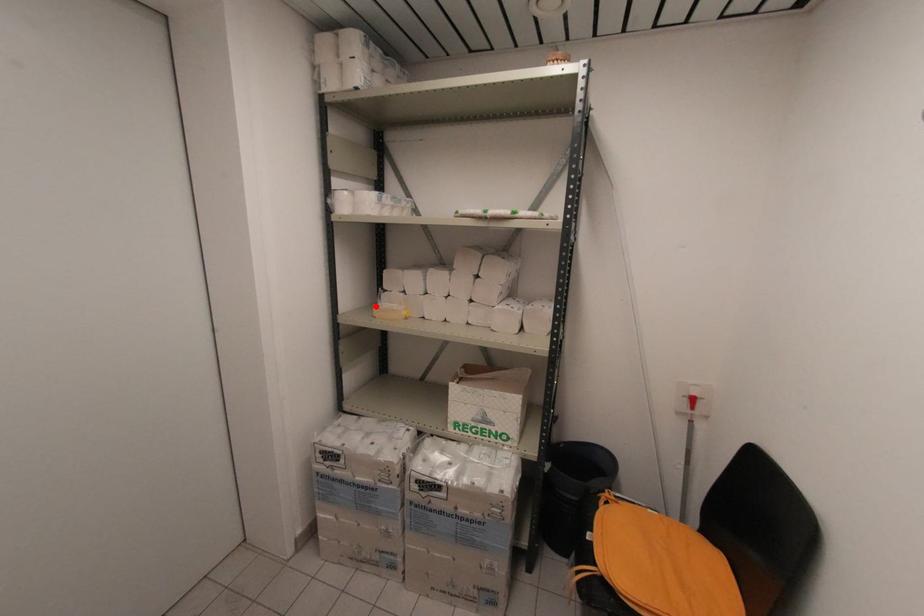
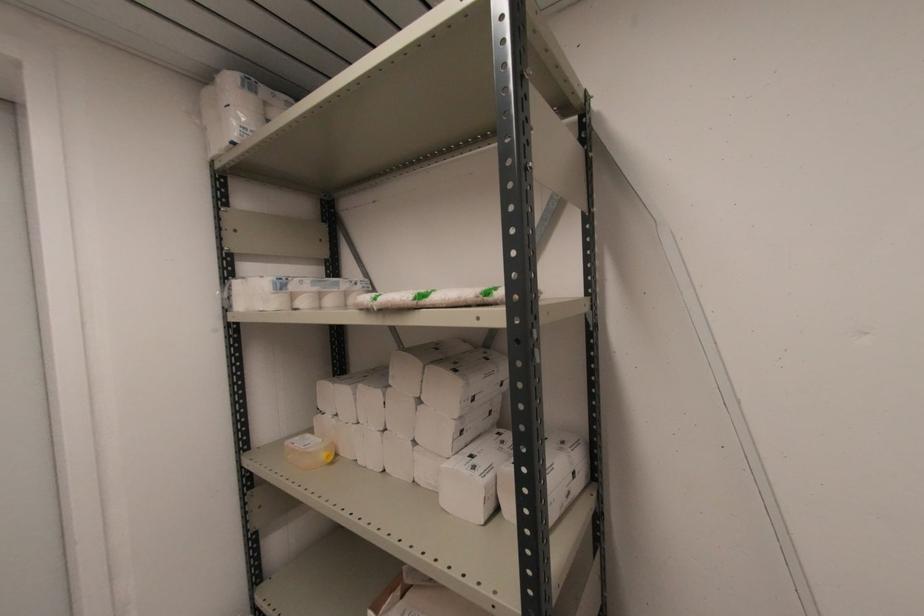
Find the pixel in the second image that matches the highlighted location in the first image.

(289, 442)